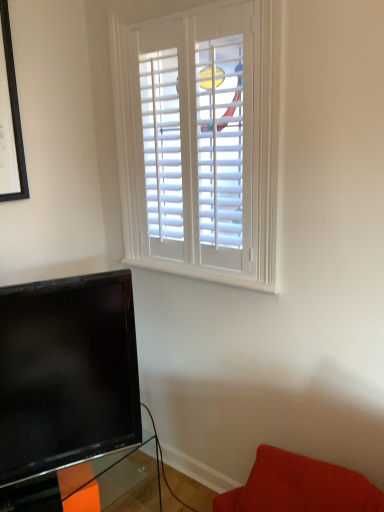
Question: Considering the relative positions of transparent glass table at lower left and velvety red cushion at lower right in the image provided, is transparent glass table at lower left to the left or to the right of velvety red cushion at lower right?

Choices:
 (A) left
 (B) right

Answer: (A)

Question: Looking at their shapes, would you say transparent glass table at lower left is wider or thinner than velvety red cushion at lower right?

Choices:
 (A) thin
 (B) wide

Answer: (B)

Question: Relative to velvety red cushion at lower right, is transparent glass table at lower left in front or behind?

Choices:
 (A) front
 (B) behind

Answer: (B)

Question: Is velvety red cushion at lower right wider or thinner than transparent glass table at lower left?

Choices:
 (A) thin
 (B) wide

Answer: (A)

Question: Is velvety red cushion at lower right in front of or behind transparent glass table at lower left in the image?

Choices:
 (A) front
 (B) behind

Answer: (A)

Question: Considering the positions of velvety red cushion at lower right and transparent glass table at lower left in the image, is velvety red cushion at lower right taller or shorter than transparent glass table at lower left?

Choices:
 (A) short
 (B) tall

Answer: (A)

Question: From a real-world perspective, relative to transparent glass table at lower left, is velvety red cushion at lower right vertically above or below?

Choices:
 (A) below
 (B) above

Answer: (B)